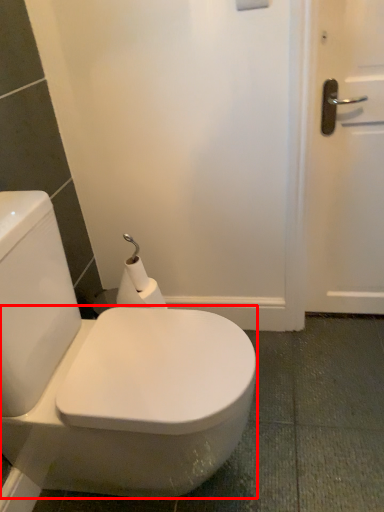
Question: From the image, what is the correct spatial relationship of bidet (annotated by the red box) in relation to toilet paper?

Choices:
 (A) left
 (B) right

Answer: (B)